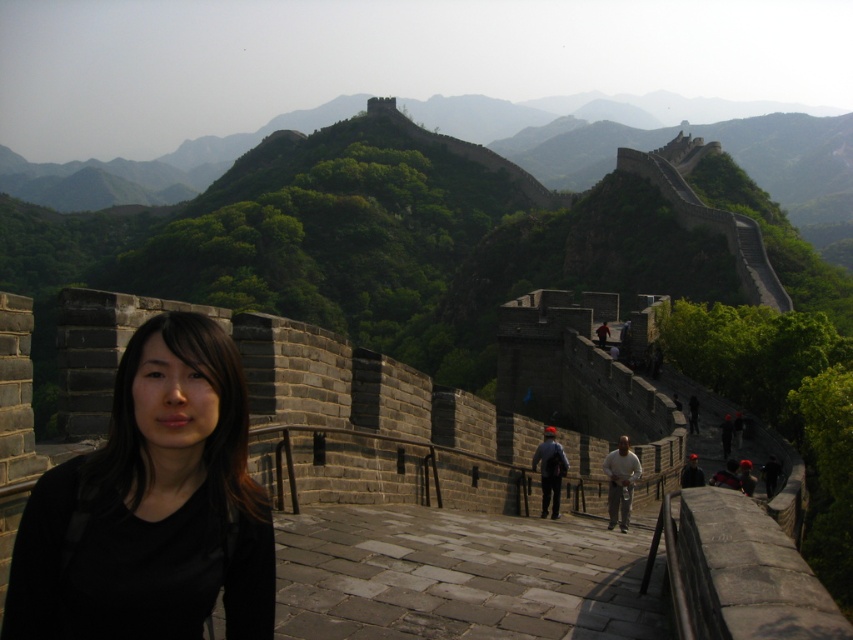
Question: Does black matte shirt at center appear over dark gray stone person at center?

Choices:
 (A) no
 (B) yes

Answer: (B)

Question: Does black matte shirt at center appear on the left side of dark gray stone person at center?

Choices:
 (A) no
 (B) yes

Answer: (B)

Question: Which point is farther to the camera?

Choices:
 (A) (x=608, y=504)
 (B) (x=566, y=465)
 (C) (x=212, y=326)

Answer: (A)

Question: Among these objects, which one is nearest to the camera?

Choices:
 (A) light brown leather jacket at center
 (B) black matte shirt at center

Answer: (B)

Question: Is light brown leather jacket at center positioned behind dark gray stone person at center?

Choices:
 (A) no
 (B) yes

Answer: (A)

Question: Which of the following is the closest to the observer?

Choices:
 (A) black matte shirt at center
 (B) dark gray stone person at center
 (C) light brown leather jacket at center

Answer: (A)